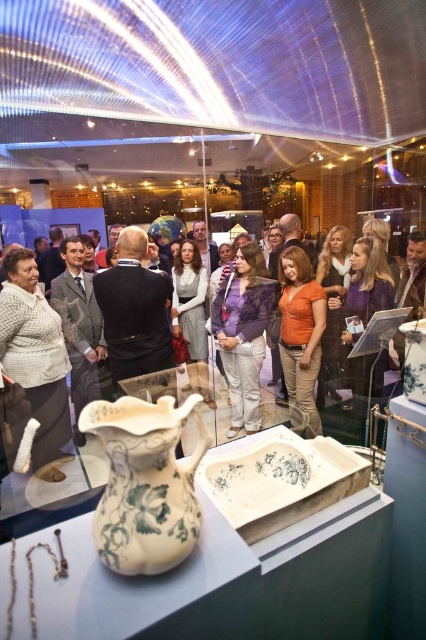
You are an assistant helping a customer who wants to try on clothes. The customer is standing in front of the matte black jacket at center and the purple lace blouse at center. Which item should they try on first if they want to start with the larger size?

The matte black jacket at center is larger in size than the purple lace blouse at center, so the customer should try on the matte black jacket at center first.

You are a photographer standing in front of the white glossy vase at center. You want to take a closeup shot of the vase without moving your position. Given that your camera can focus on objects within 25 inches, will you be able to capture the vase clearly?

The distance between the white glossy vase at center and the camera is 27.77 inches, which is beyond the camera focus range of 25 inches. Therefore, you won not be able to capture the vase clearly without moving closer.